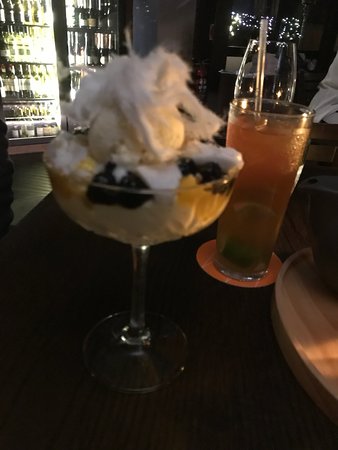
Find the location of a particular element. This screenshot has height=450, width=338. beer bottle is located at coordinates (102, 49), (262, 58).